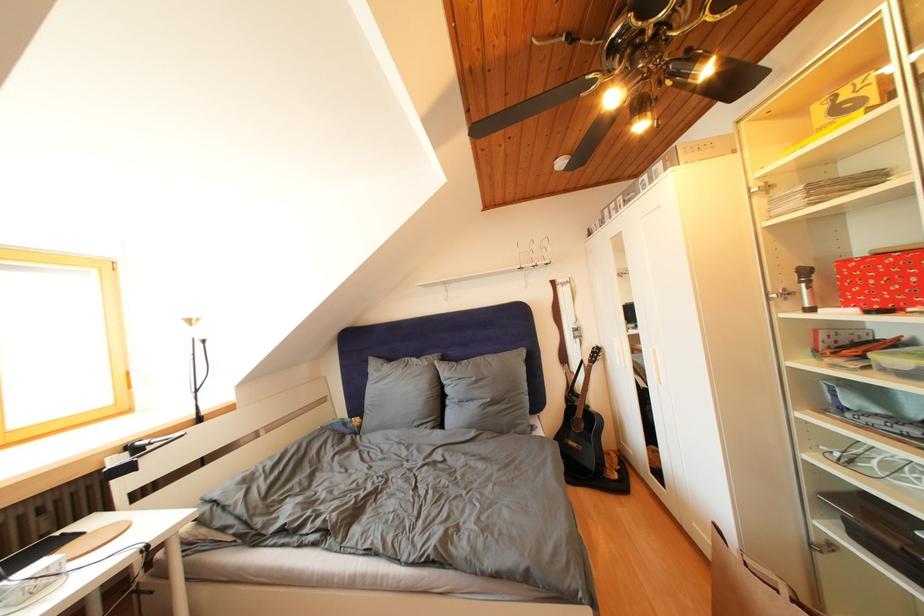
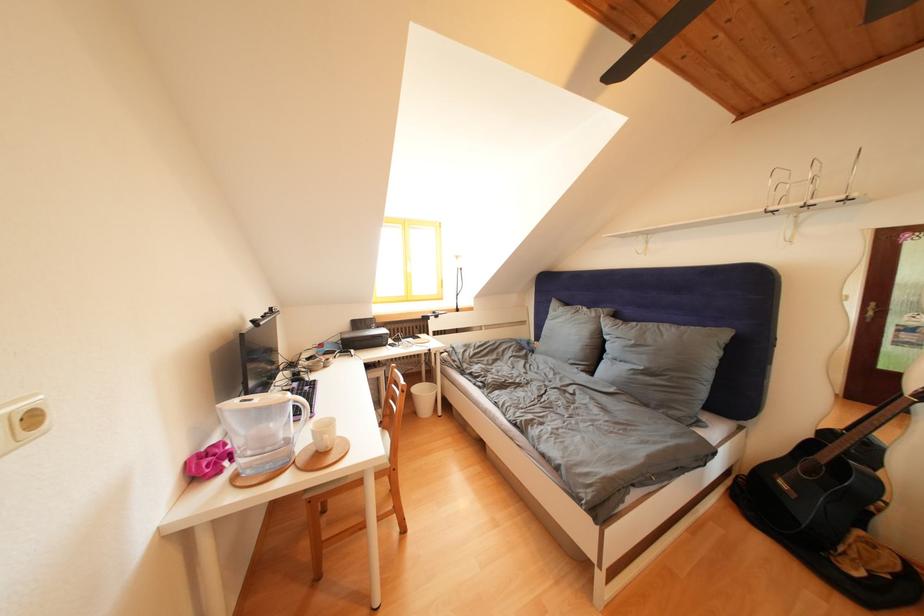
Locate, in the second image, the point that corresponds to point (433, 369) in the first image.

(602, 320)